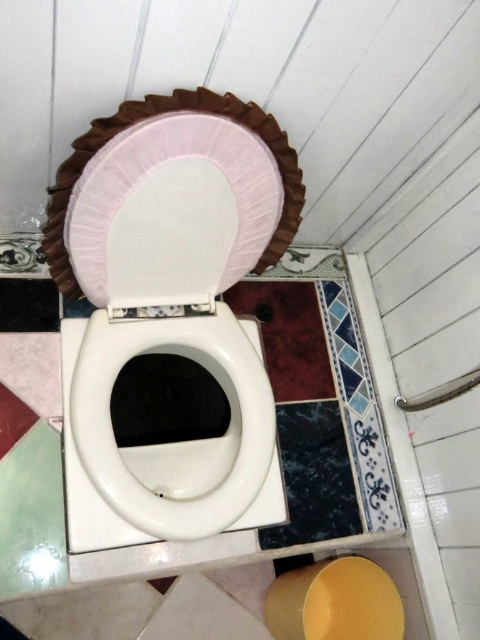
Does white glossy toilet bowl at center appear on the right side of pink fabric toilet seat cover at center?

No, white glossy toilet bowl at center is not to the right of pink fabric toilet seat cover at center.

Where is `white glossy toilet bowl at center`? The image size is (480, 640). white glossy toilet bowl at center is located at coordinates (166, 444).